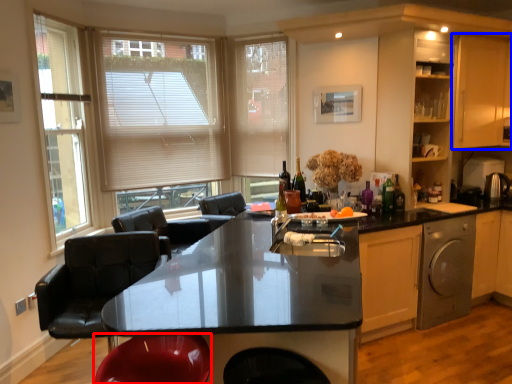
Question: Which object appears closest to the camera in this image, swivel chair (highlighted by a red box) or cabinetry (highlighted by a blue box)?

Choices:
 (A) swivel chair
 (B) cabinetry

Answer: (A)